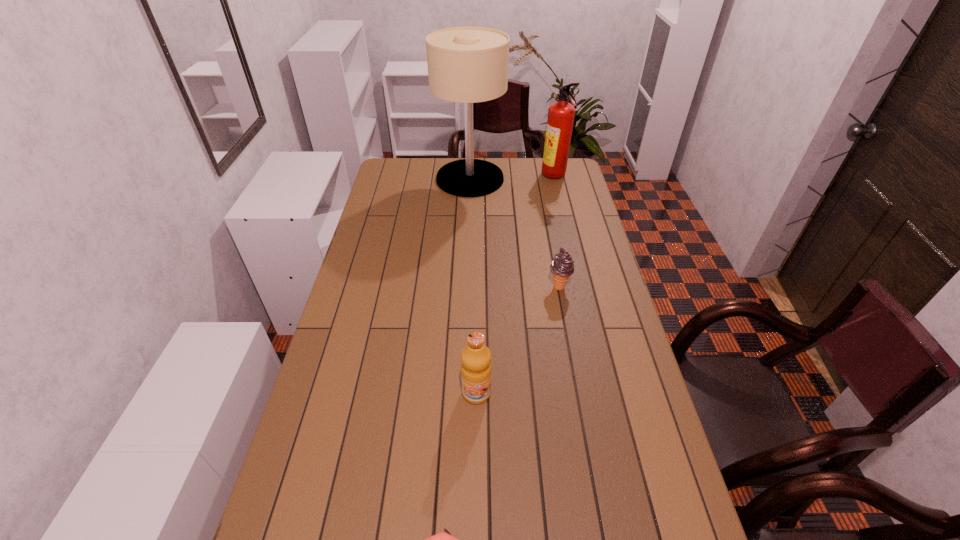
Where is `free spot located 0.290m on the front label of the third shortest object`? free spot located 0.290m on the front label of the third shortest object is located at coordinates (475, 525).

Locate an element on the screen. The width and height of the screenshot is (960, 540). vacant space located 0.260m on the front of the fourth tallest object is located at coordinates click(573, 358).

Identify the location of table lamp present at the far edge. (467, 65).

Where is `fire extinguisher that is at the far edge`? This screenshot has height=540, width=960. fire extinguisher that is at the far edge is located at coordinates (561, 114).

The width and height of the screenshot is (960, 540). I want to click on fire extinguisher that is at the right edge, so click(x=561, y=114).

Image resolution: width=960 pixels, height=540 pixels. In order to click on icecream at the right edge in this screenshot , I will do `click(562, 267)`.

Find the location of a particular element. The image size is (960, 540). object located at the far right corner is located at coordinates (561, 114).

Where is `vacant space at the far edge`? The width and height of the screenshot is (960, 540). vacant space at the far edge is located at coordinates (537, 165).

In the image, there is a desktop. Find the location of `vacant space at the left edge`. vacant space at the left edge is located at coordinates (275, 510).

The height and width of the screenshot is (540, 960). I want to click on vacant point at the right edge, so click(601, 426).